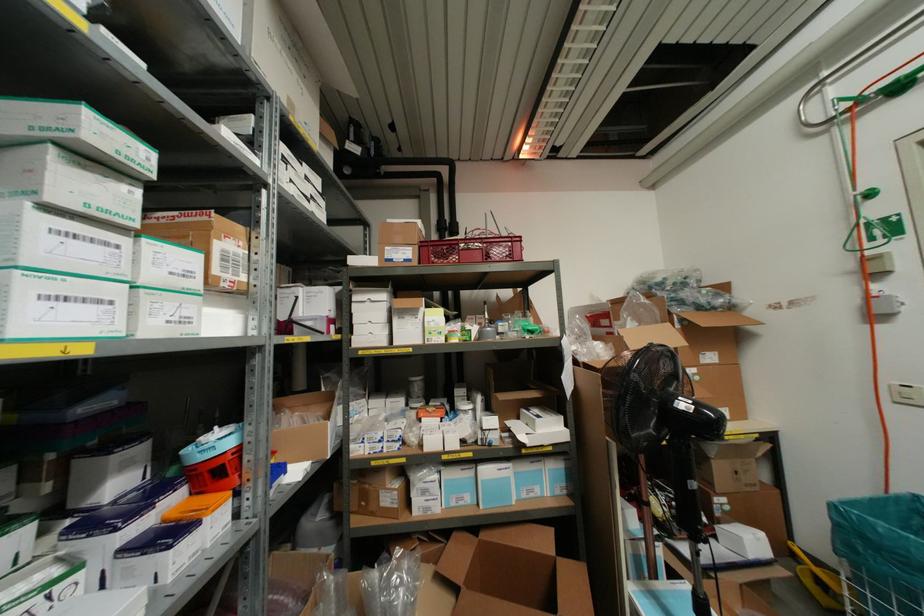
I want to click on blue plastic tray, so click(x=661, y=598).